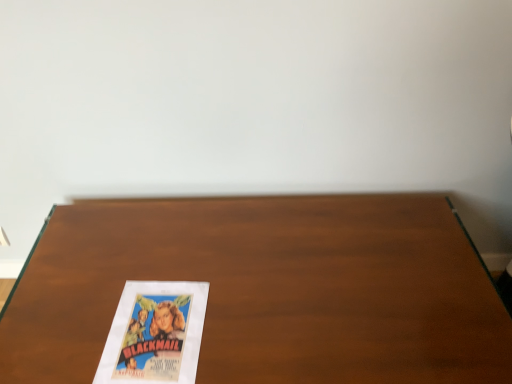
Image resolution: width=512 pixels, height=384 pixels. Find the location of `blank space situated above wooden table at center (from a real-world perspective)`. blank space situated above wooden table at center (from a real-world perspective) is located at coordinates (247, 272).